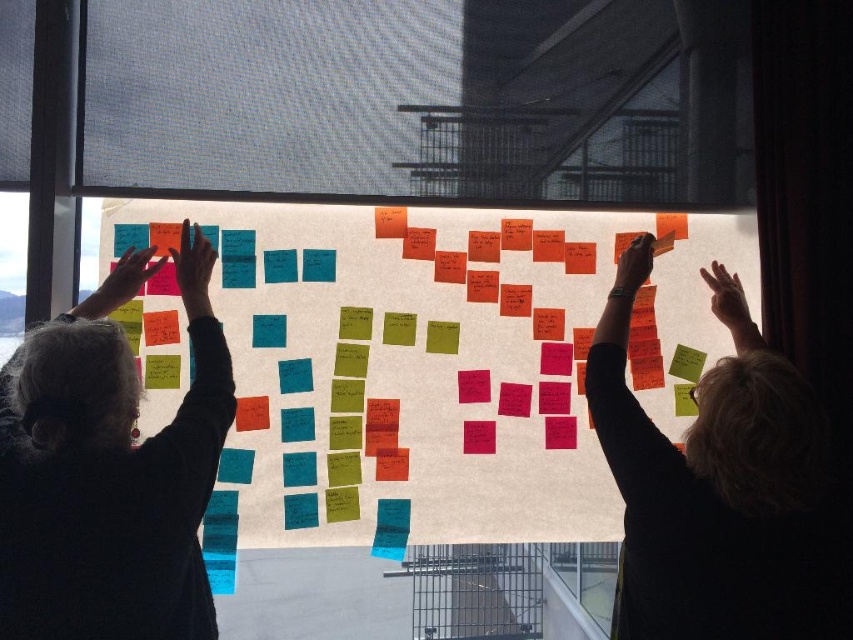
Does point (132, 273) come closer to viewer compared to point (724, 298)?

Yes, point (132, 273) is in front of point (724, 298).

Between matte plastic hand at upper left and translucent skin hand at upper right, which one appears on the left side from the viewer's perspective?

matte plastic hand at upper left is more to the left.

This screenshot has height=640, width=853. Describe the element at coordinates (123, 280) in the screenshot. I see `matte plastic hand at upper left` at that location.

The height and width of the screenshot is (640, 853). I want to click on matte plastic hand at upper left, so click(x=123, y=280).

Does point (103, 280) come in front of point (631, 273)?

Yes, it is in front of point (631, 273).

Can you confirm if matte plastic hand at upper left is positioned to the right of matte black hand at upper right?

Incorrect, matte plastic hand at upper left is not on the right side of matte black hand at upper right.

At what (x,y) coordinates should I click in order to perform the action: click on matte plastic hand at upper left. Please return your answer as a coordinate pair (x, y). Looking at the image, I should click on (123, 280).

Can you confirm if colorful sticky notes at center is bigger than matte black sweater at left?

Yes, colorful sticky notes at center is bigger than matte black sweater at left.

Which is in front, point (161, 403) or point (80, 364)?

Point (80, 364)

The width and height of the screenshot is (853, 640). What are the coordinates of `colorful sticky notes at center` in the screenshot? It's located at (428, 364).